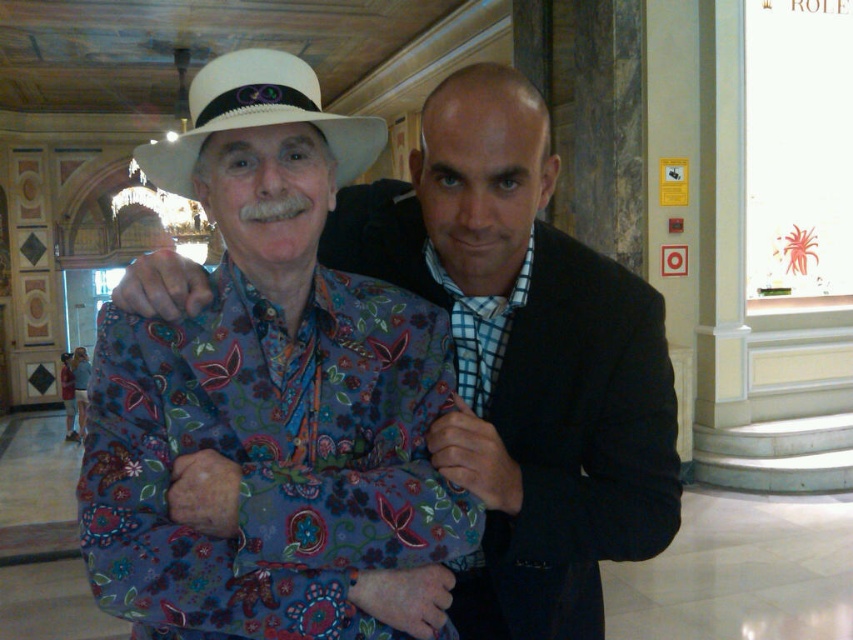
You are a photographer positioned in front of the two people in the image. You want to take a photo that includes both the floral fabric shirt at center and the white straw fedora at center. Which object should you focus on first to ensure both are in sharp focus?

The floral fabric shirt at center is further to the viewer than the white straw fedora at center, so you should focus on the floral fabric shirt at center first to ensure both are in sharp focus.

You are an interior designer assessing the spatial layout of this grand indoor setting. You notice a point at coordinates (x=523, y=364). Based on the scene description, what object does this coordinate most likely represent?

The point at coordinates (x=523, y=364) corresponds to the floral fabric shirt at center, as stated in the Objects Description.

You are standing in the grand building and want to determine which point is closer to you. The points are located at coordinates point (474, 280) and point (352, 141). Which point is closer to you?

Point (474, 280) is further to the viewer than point (352, 141), so the closer point to you is point (352, 141).